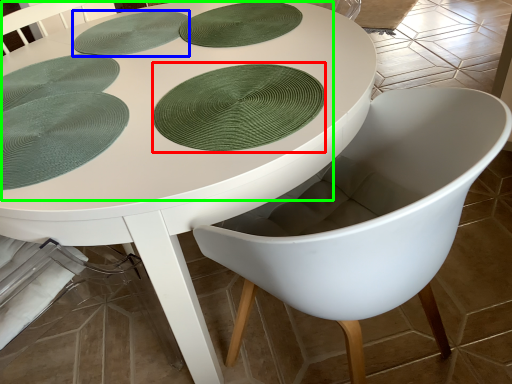
Question: Based on their relative distances, which object is nearer to paper plate (highlighted by a red box)? Choose from platter (highlighted by a blue box) and poker table (highlighted by a green box).

Choices:
 (A) platter
 (B) poker table

Answer: (B)